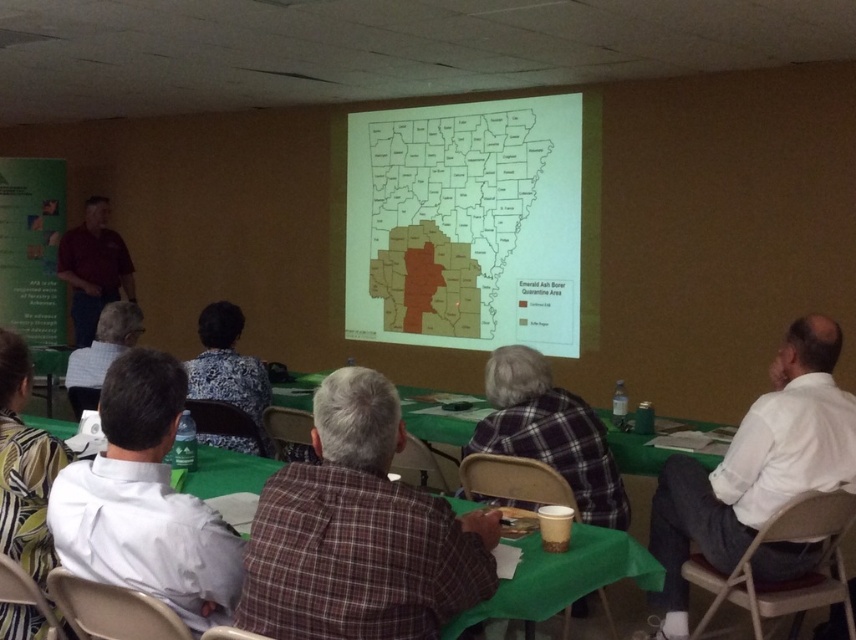
You are organizing a workshop and need to seat participants based on their shirt colors. The room has two sections divided by a central aisle. The left section is for those with maroon shirts, and the right section is for white shirts. Given the current arrangement, can the white shirt at lower right and maroon shirt at left be seated in their respective sections without moving their current positions?

The white shirt at lower right is already positioned in the right section of the room, and the maroon shirt at left is in the left section. Since their current positions align with the required sections, they do not need to move.

Looking at this image, you are standing at the entrance of the room and notice a person wearing a white shirt at lower right. Can you determine the exact coordinates of where this person is sitting?

The white shirt at lower right is located at point (755, 467), so the exact coordinates are 0.730 on the x axis and 0.883 on the y axis.